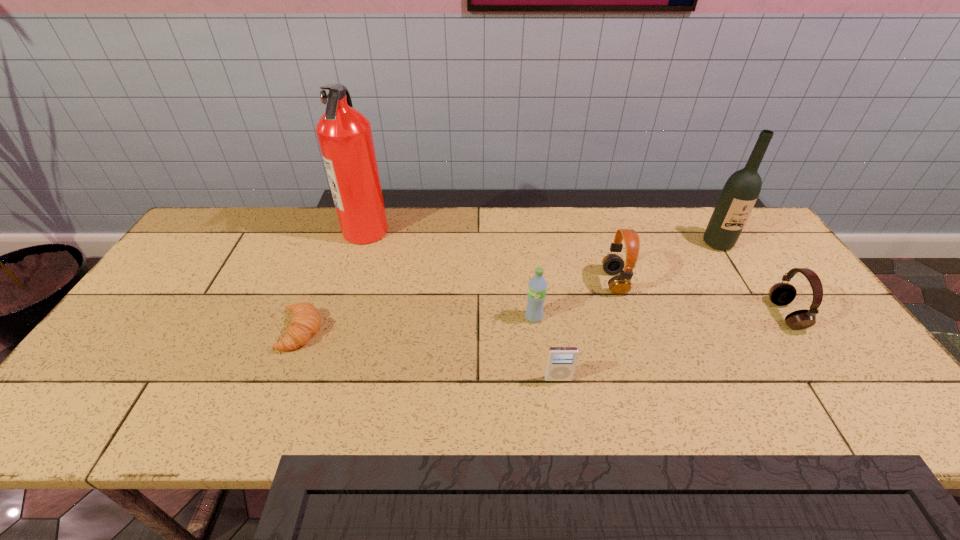
At what (x,y) coordinates should I click in order to perform the action: click on vacant position located 0.140m at the nozzle of the tallest object. Please return your answer as a coordinate pair (x, y). Looking at the image, I should click on (431, 230).

At what (x,y) coordinates should I click in order to perform the action: click on free location located on the labeled side of the wine bottle. Please return your answer as a coordinate pair (x, y). Looking at the image, I should click on (756, 305).

Where is `vacant space located 0.200m on the ear cups of the left headset`? Image resolution: width=960 pixels, height=540 pixels. vacant space located 0.200m on the ear cups of the left headset is located at coordinates (533, 282).

Locate an element on the screen. This screenshot has width=960, height=540. blank area located on the ear cups of the left headset is located at coordinates (516, 282).

Identify the location of vacant space located on the ear cups of the left headset. This screenshot has height=540, width=960. pos(516,282).

The width and height of the screenshot is (960, 540). I want to click on blank space located on the front of the water bottle, so click(x=540, y=376).

You are a GUI agent. You are given a task and a screenshot of the screen. Output one action in this format:
    pyautogui.click(x=<x>, y=<y>)
    Task: Click on the vacant region located 0.380m on the ear pads of the shorter headset
    This screenshot has width=960, height=540.
    Given the screenshot: What is the action you would take?
    pyautogui.click(x=629, y=315)

You are a GUI agent. You are given a task and a screenshot of the screen. Output one action in this format:
    pyautogui.click(x=<x>, y=<y>)
    Task: Click on the free spot located 0.390m on the ear pads of the shorter headset
    
    Given the screenshot: What is the action you would take?
    pyautogui.click(x=625, y=315)

I want to click on free location located 0.340m on the ear pads of the shorter headset, so click(644, 315).

Where is `free space located 0.090m on the front-facing side of the iPod`? This screenshot has width=960, height=540. free space located 0.090m on the front-facing side of the iPod is located at coordinates (564, 417).